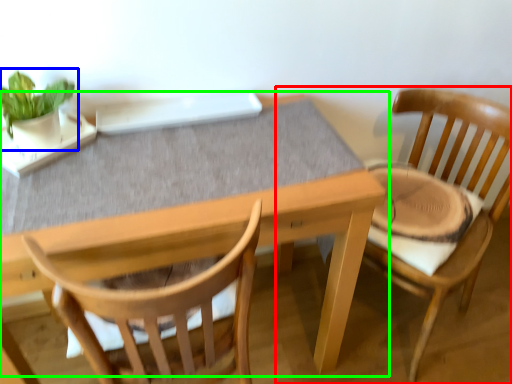
Question: Which is nearer to the chair (highlighted by a red box)? houseplant (highlighted by a blue box) or table (highlighted by a green box).

Choices:
 (A) houseplant
 (B) table

Answer: (B)